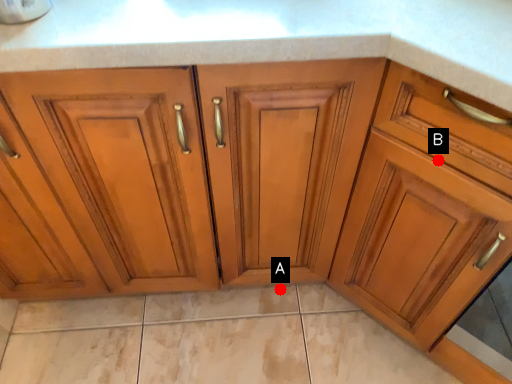
Question: Two points are circled on the image, labeled by A and B beside each circle. Which of the following is the closest to the observer?

Choices:
 (A) A is closer
 (B) B is closer

Answer: (B)